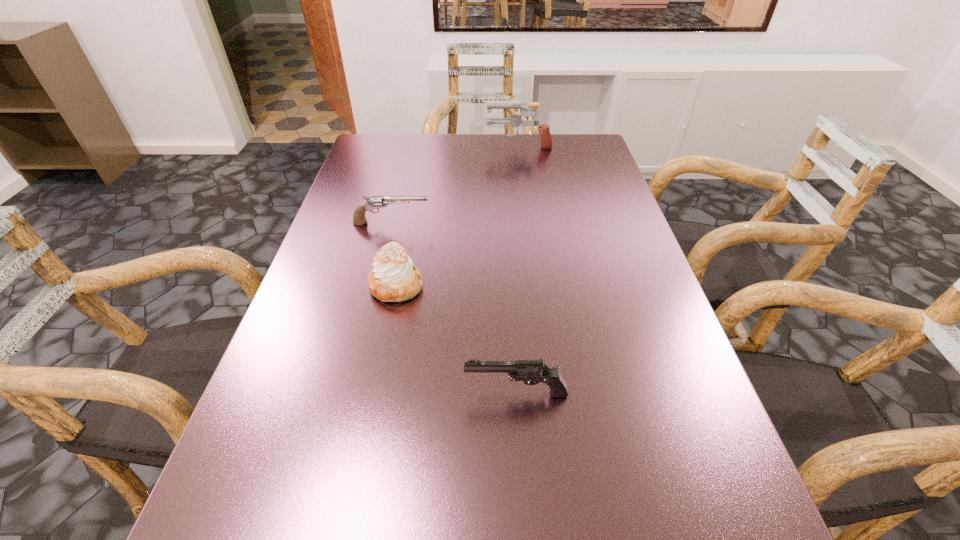
At what (x,y) coordinates should I click in order to perform the action: click on vacant space at the left edge of the desktop. Please return your answer as a coordinate pair (x, y). This screenshot has width=960, height=540. Looking at the image, I should click on (366, 334).

Locate an element on the screen. blank space at the right edge is located at coordinates (667, 519).

You are a GUI agent. You are given a task and a screenshot of the screen. Output one action in this format:
    pyautogui.click(x=<x>, y=<y>)
    Task: Click on the vacant space at the far left corner of the desktop
    Image resolution: width=960 pixels, height=540 pixels.
    Given the screenshot: What is the action you would take?
    pyautogui.click(x=385, y=154)

Where is `vacant region at the far right corner of the desktop`? vacant region at the far right corner of the desktop is located at coordinates (x=597, y=144).

This screenshot has width=960, height=540. I want to click on vacant area that lies between the farthest gun and the nearest gun, so click(517, 269).

At what (x,y) coordinates should I click in order to perform the action: click on vacant space in between the shortest gun and the nearest gun. Please return your answer as a coordinate pair (x, y). The image size is (960, 540). Looking at the image, I should click on (454, 308).

Identify the location of empty space between the tallest gun and the nearest gun. This screenshot has height=540, width=960. (517, 269).

The width and height of the screenshot is (960, 540). In order to click on free space between the farthest object and the shortest object in this screenshot , I will do `click(455, 184)`.

Find the location of `unoccupied position between the nearest object and the third farthest object`. unoccupied position between the nearest object and the third farthest object is located at coordinates (456, 340).

At what (x,y) coordinates should I click in order to perform the action: click on free space between the third farthest object and the nearest object. Please return your answer as a coordinate pair (x, y). The image size is (960, 540). Looking at the image, I should click on (456, 340).